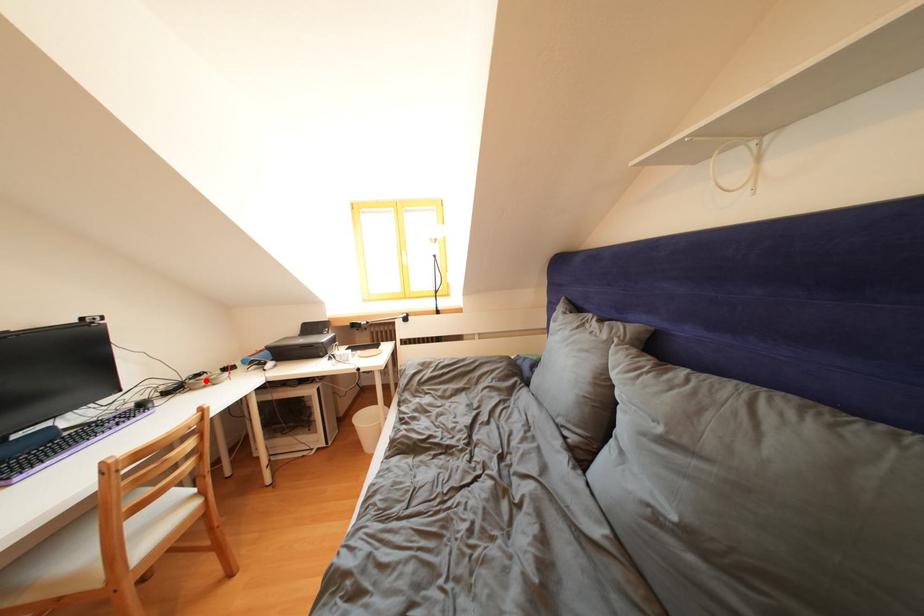
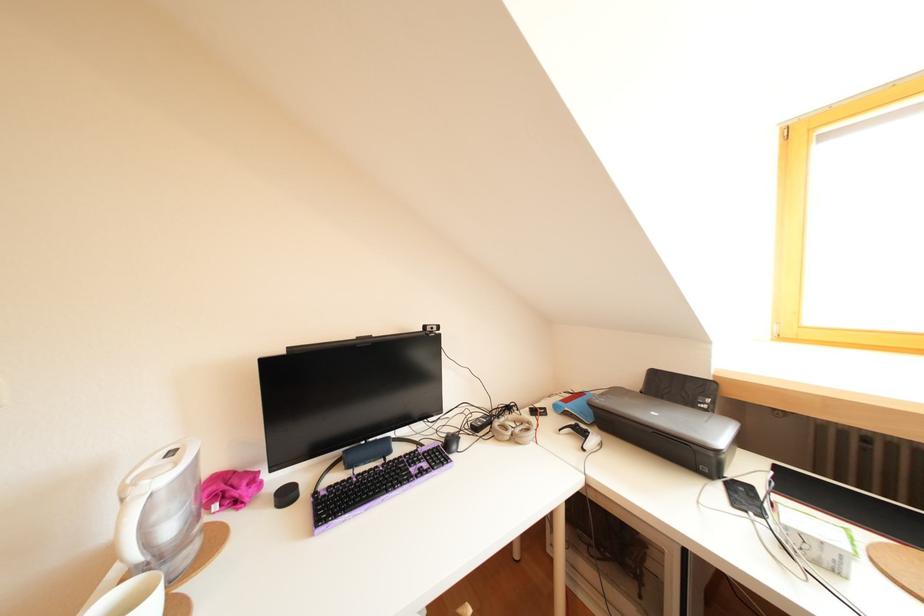
Find the pixel in the second image that matches the highlighted location in the first image.

(516, 413)